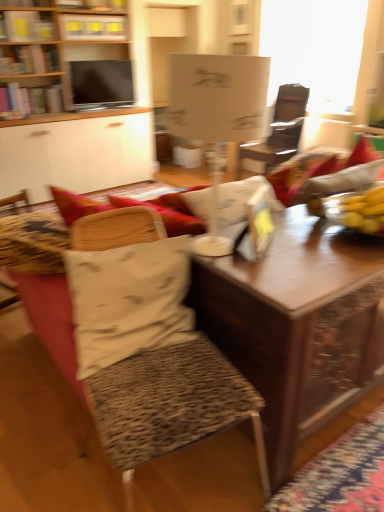
Question: Is white matte lampshade at center wider than matte black tv at upper left?

Choices:
 (A) no
 (B) yes

Answer: (B)

Question: Considering the relative sizes of white matte lampshade at center and matte black tv at upper left in the image provided, is white matte lampshade at center thinner than matte black tv at upper left?

Choices:
 (A) yes
 (B) no

Answer: (B)

Question: Is matte black tv at upper left a part of white matte lampshade at center?

Choices:
 (A) no
 (B) yes

Answer: (A)

Question: Is white matte lampshade at center placed right next to matte black tv at upper left?

Choices:
 (A) no
 (B) yes

Answer: (A)

Question: Considering the relative sizes of white matte lampshade at center and matte black tv at upper left in the image provided, is white matte lampshade at center smaller than matte black tv at upper left?

Choices:
 (A) yes
 (B) no

Answer: (B)

Question: Considering the relative sizes of white matte lampshade at center and matte black tv at upper left in the image provided, is white matte lampshade at center shorter than matte black tv at upper left?

Choices:
 (A) no
 (B) yes

Answer: (A)

Question: Is wooden bookshelf at upper center completely or partially inside wooden desk at center?

Choices:
 (A) yes
 (B) no

Answer: (B)

Question: Is the depth of wooden desk at center greater than that of wooden bookshelf at upper center?

Choices:
 (A) no
 (B) yes

Answer: (A)

Question: Is there a large distance between wooden desk at center and wooden bookshelf at upper center?

Choices:
 (A) yes
 (B) no

Answer: (A)

Question: Can you confirm if wooden desk at center is positioned to the left of wooden bookshelf at upper center?

Choices:
 (A) no
 (B) yes

Answer: (B)

Question: Does wooden desk at center touch wooden bookshelf at upper center?

Choices:
 (A) no
 (B) yes

Answer: (A)

Question: Is wooden desk at center located outside wooden bookshelf at upper center?

Choices:
 (A) no
 (B) yes

Answer: (B)

Question: Is matte black tv at upper left facing towards wooden desk at center?

Choices:
 (A) no
 (B) yes

Answer: (A)